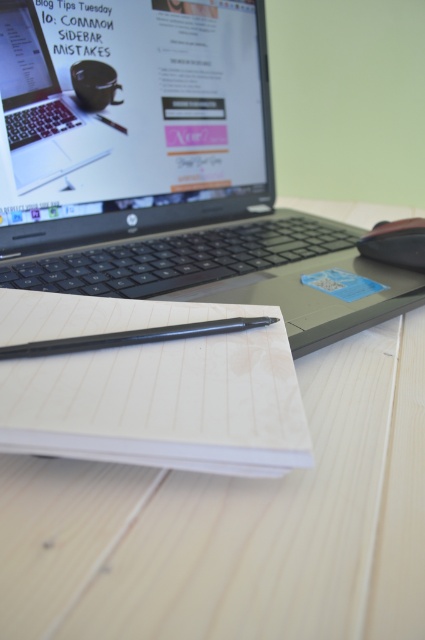
Does black plastic mouse at right appear on the left side of matte black coffee cup at center?

Incorrect, black plastic mouse at right is not on the left side of matte black coffee cup at center.

Can you confirm if black plastic mouse at right is smaller than matte black coffee cup at center?

Actually, black plastic mouse at right might be larger than matte black coffee cup at center.

Is point (391, 260) in front of point (110, 65)?

Yes, it is in front of point (110, 65).

You are a GUI agent. You are given a task and a screenshot of the screen. Output one action in this format:
    pyautogui.click(x=<x>, y=<y>)
    Task: Click on the black plastic mouse at right
    This screenshot has width=425, height=640.
    Given the screenshot: What is the action you would take?
    pyautogui.click(x=396, y=243)

Is light wood table at center positioned in front of matte black laptop at upper center?

Yes, light wood table at center is in front of matte black laptop at upper center.

Is point (51, 468) less distant than point (189, 97)?

Yes, it is.

Between point (362, 401) and point (195, 132), which one is positioned in front?

Point (362, 401) is in front.

In order to click on light wood table at center in this screenshot , I will do `click(238, 524)`.

Is light wood table at center shorter than matte black coffee cup at center?

Incorrect, light wood table at center's height does not fall short of matte black coffee cup at center's.

From the picture: Between light wood table at center and matte black coffee cup at center, which one has more height?

light wood table at center

Between point (368, 611) and point (108, 97), which one is positioned behind?

The point (108, 97) is behind.

What are the coordinates of `light wood table at center` in the screenshot? It's located at (238, 524).